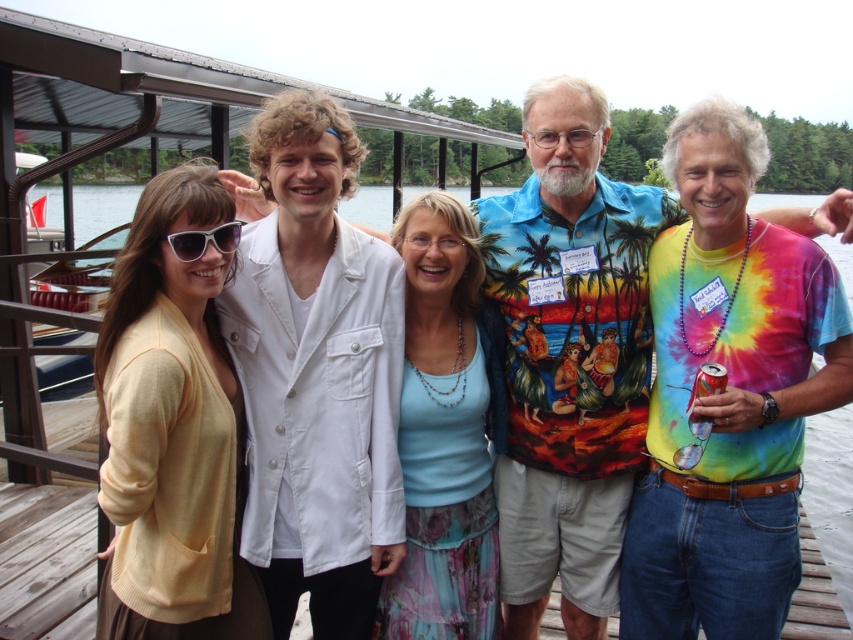
Does white matte blazer at center have a greater height compared to matte yellow cardigan at center?

Correct, white matte blazer at center is much taller as matte yellow cardigan at center.

Who is positioned more to the left, white matte blazer at center or matte yellow cardigan at center?

Positioned to the left is matte yellow cardigan at center.

This screenshot has width=853, height=640. I want to click on white matte blazer at center, so click(315, 372).

Based on the photo, is matte yellow cardigan at center wider than matte white sunglasses at left?

Correct, the width of matte yellow cardigan at center exceeds that of matte white sunglasses at left.

Is point (184, 225) positioned behind point (224, 230)?

No, (184, 225) is closer to viewer.

At what (x,y) coordinates should I click in order to perform the action: click on matte yellow cardigan at center. Please return your answer as a coordinate pair (x, y). Looking at the image, I should click on (172, 429).

This screenshot has height=640, width=853. Identify the location of matte yellow cardigan at center. (172, 429).

Find the location of a particular element. white matte blazer at center is located at coordinates (315, 372).

Can you confirm if white matte blazer at center is positioned below matte white sunglasses at left?

Yes.

At what (x,y) coordinates should I click in order to perform the action: click on white matte blazer at center. Please return your answer as a coordinate pair (x, y). Looking at the image, I should click on (315, 372).